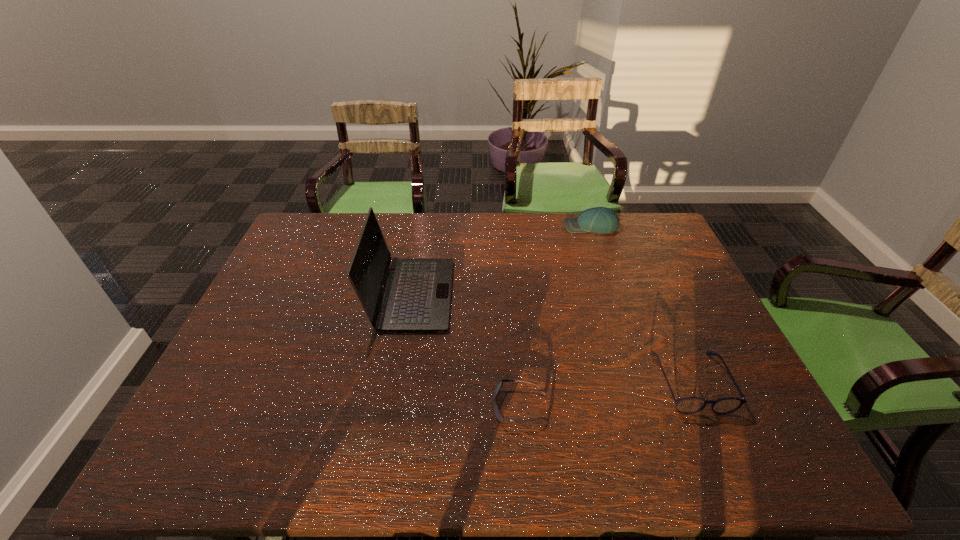
At what (x,y) coordinates should I click in order to perform the action: click on blank space at the far left corner. Please return your answer as a coordinate pair (x, y). The width and height of the screenshot is (960, 540). Looking at the image, I should click on (329, 227).

Find the location of a particular element. This screenshot has width=960, height=540. vacant space at the far right corner of the desktop is located at coordinates (637, 245).

Image resolution: width=960 pixels, height=540 pixels. In the image, there is a desktop. Find the location of `blank space at the near right corner`. blank space at the near right corner is located at coordinates (733, 436).

Locate an element on the screen. The image size is (960, 540). empty space that is in between the spectacles and the farthest object is located at coordinates (640, 304).

Where is `vacant area that lies between the tallest object and the baseball cap`? Image resolution: width=960 pixels, height=540 pixels. vacant area that lies between the tallest object and the baseball cap is located at coordinates (501, 261).

The height and width of the screenshot is (540, 960). In order to click on vacant region between the third object from right to left and the farthest object in this screenshot , I will do click(556, 316).

At what (x,y) coordinates should I click in order to perform the action: click on free space between the leftmost object and the baseball cap. Please return your answer as a coordinate pair (x, y). Looking at the image, I should click on (501, 261).

Find the location of a particular element. This screenshot has height=540, width=960. vacant point located between the third object from right to left and the leftmost object is located at coordinates (466, 350).

This screenshot has height=540, width=960. In order to click on empty space between the leftmost object and the third object from right to left in this screenshot , I will do `click(466, 350)`.

The image size is (960, 540). Identify the location of blank region between the spectacles and the baseball cap. (640, 304).